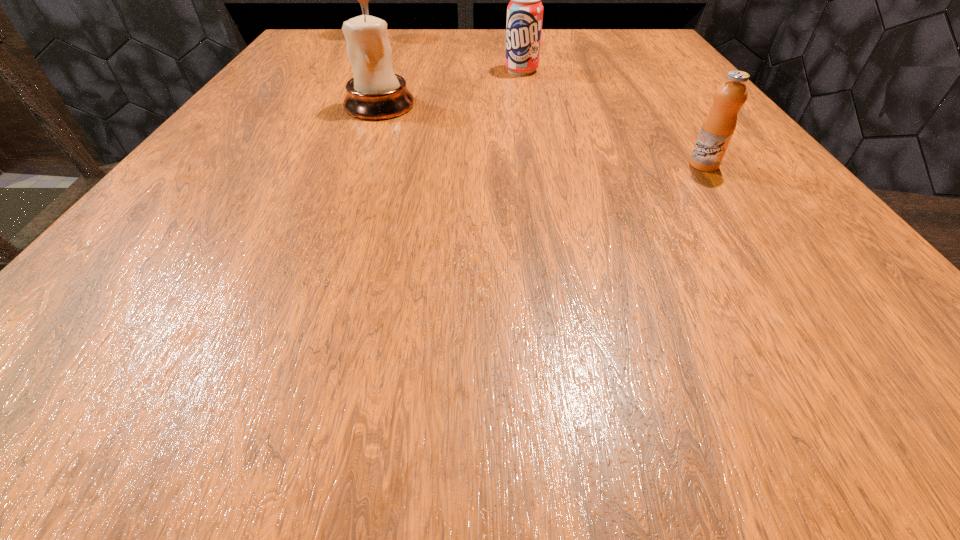
The width and height of the screenshot is (960, 540). I want to click on the farthest object, so click(363, 0).

Locate an element on the screen. candle holder is located at coordinates (374, 93).

You are a GUI agent. You are given a task and a screenshot of the screen. Output one action in this format:
    pyautogui.click(x=<x>, y=<y>)
    Task: Click on the third nearest object
    The height and width of the screenshot is (540, 960).
    Given the screenshot: What is the action you would take?
    pyautogui.click(x=525, y=10)

Where is `soda can`? soda can is located at coordinates (525, 10).

The height and width of the screenshot is (540, 960). Find the location of `the rightmost object`. the rightmost object is located at coordinates (718, 127).

Locate an element on the screen. orange juice is located at coordinates (718, 127).

Where is `free space located 0.150m on the right of the wineglass`? The width and height of the screenshot is (960, 540). free space located 0.150m on the right of the wineglass is located at coordinates tap(448, 37).

At what (x,y) coordinates should I click in order to perform the action: click on free space located on the front of the candle holder. Please return your answer as a coordinate pair (x, y). The image size is (960, 540). Looking at the image, I should click on (361, 155).

This screenshot has height=540, width=960. I want to click on vacant region located on the front of the second object from right to left, so click(536, 154).

You are a GUI agent. You are given a task and a screenshot of the screen. Output one action in this format:
    pyautogui.click(x=<x>, y=<y>)
    Task: Click on the vacant space located on the front label of the rightmost object
    This screenshot has width=960, height=540.
    Given the screenshot: What is the action you would take?
    pyautogui.click(x=734, y=211)